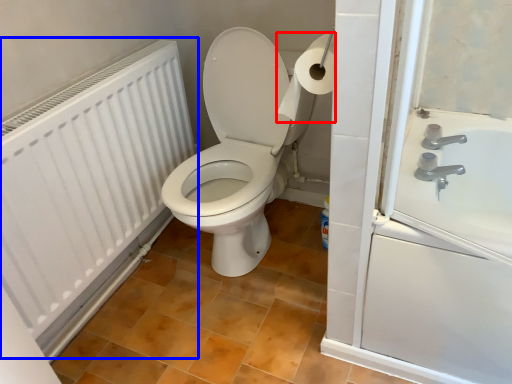
Question: Which object is further to the camera taking this photo, toilet paper (highlighted by a red box) or radiator (highlighted by a blue box)?

Choices:
 (A) toilet paper
 (B) radiator

Answer: (A)